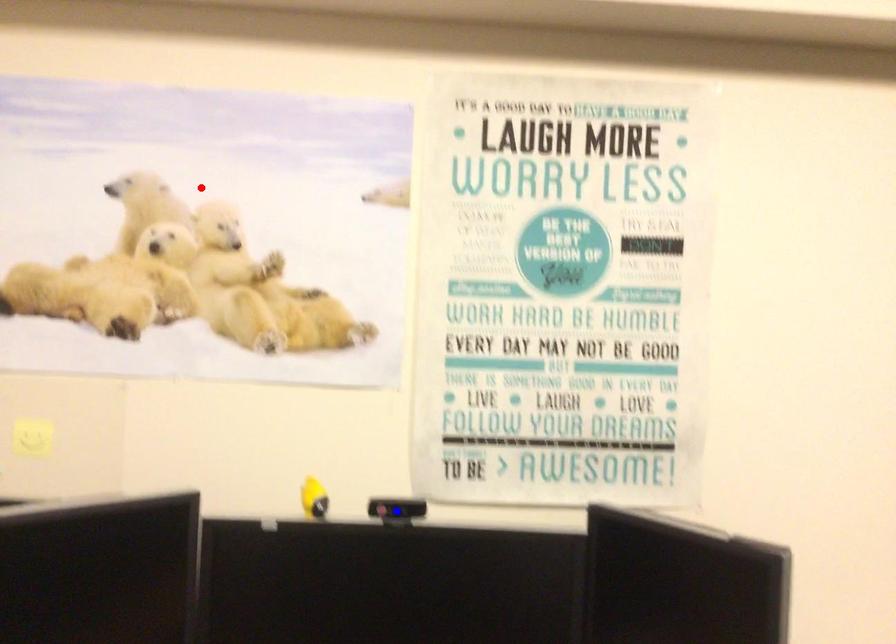
Question: Two points are marked on the image. Which point is closer to the camera?

Choices:
 (A) Blue point is closer.
 (B) Red point is closer.

Answer: (A)